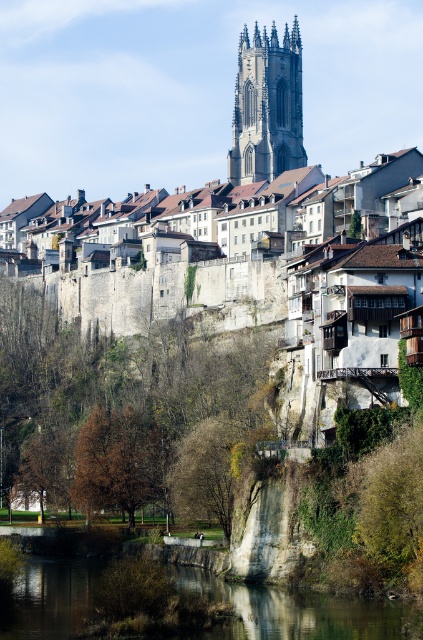
You are standing on a path near the green stone river at lower center and want to reach the smooth stone tower at upper center. Which direction should you head towards?

You should head to the right because the green stone river at lower center is to the left of the smooth stone tower at upper center.

You are a tourist standing at the edge of the green stone river at lower center and want to take a photo of the smooth stone tower at upper center. Is the tower visible from your current position? Explain why or why not.

The green stone river at lower center has a lesser height compared to the smooth stone tower at upper center. Since the river is lower in elevation, the tower should be visible as it stands taller above the river.

You are a tourist standing at the edge of the green stone river at lower center, looking towards the smooth stone tower at upper center. Which object appears larger in your view?

The smooth stone tower at upper center appears larger than the green stone river at lower center because the description states that the green stone river at lower center is smaller than the smooth stone tower at upper center.